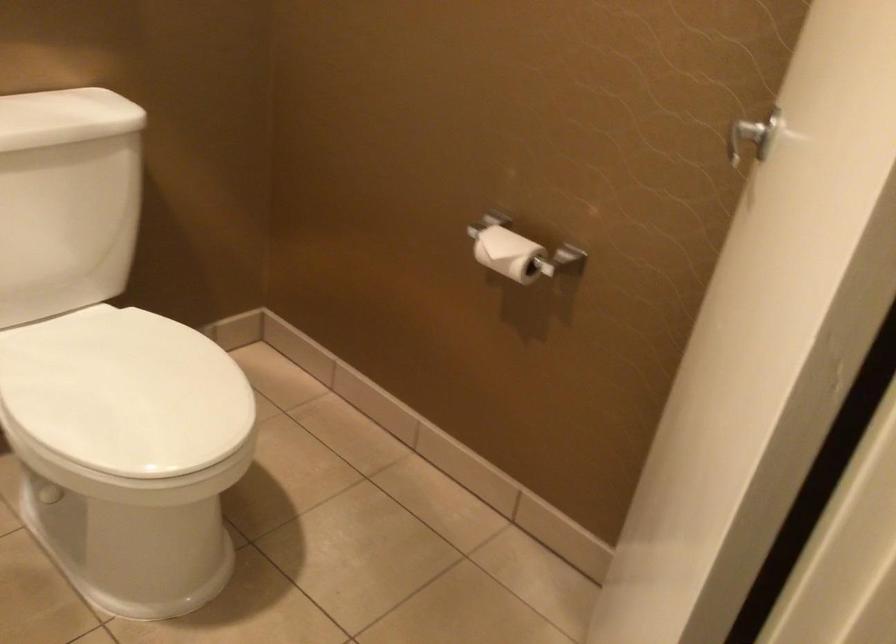
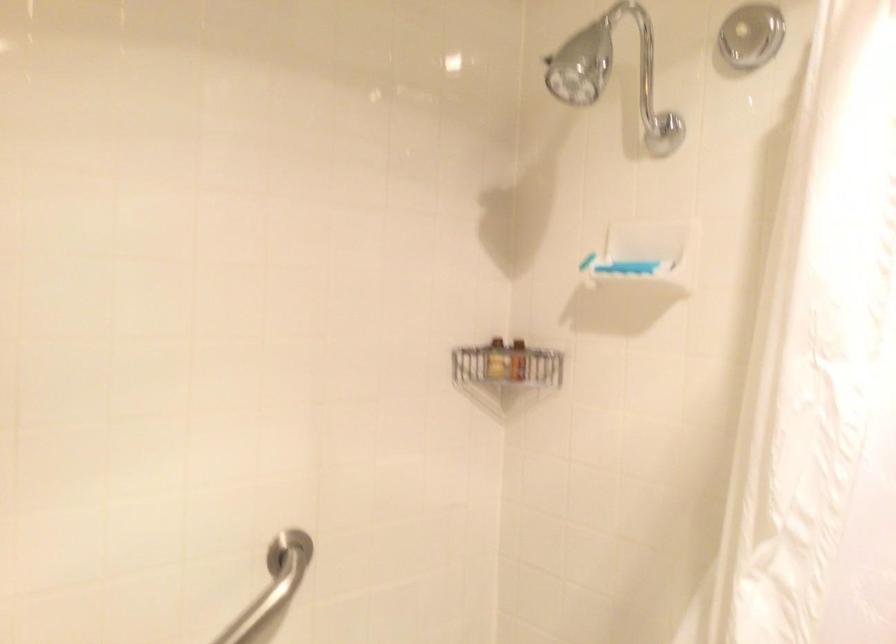
Question: The first image is from the beginning of the video and the second image is from the end. How did the camera likely rotate when shooting the video?

Choices:
 (A) Left
 (B) Right
 (C) Up
 (D) Down

Answer: (A)